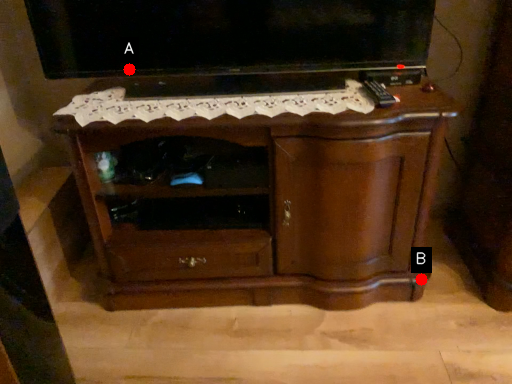
Question: Two points are circled on the image, labeled by A and B beside each circle. Which point appears farthest from the camera in this image?

Choices:
 (A) A is further
 (B) B is further

Answer: (B)